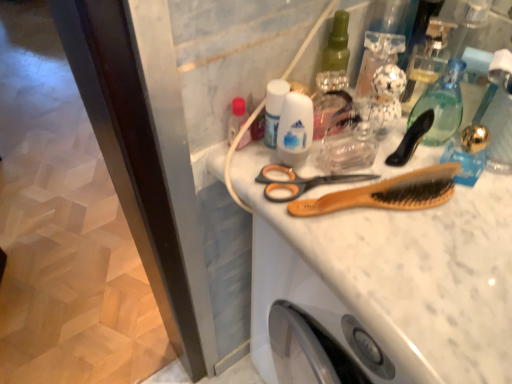
Find the location of a particular element. This screenshot has height=384, width=512. free space in front of black plastic brush at upper right is located at coordinates (420, 251).